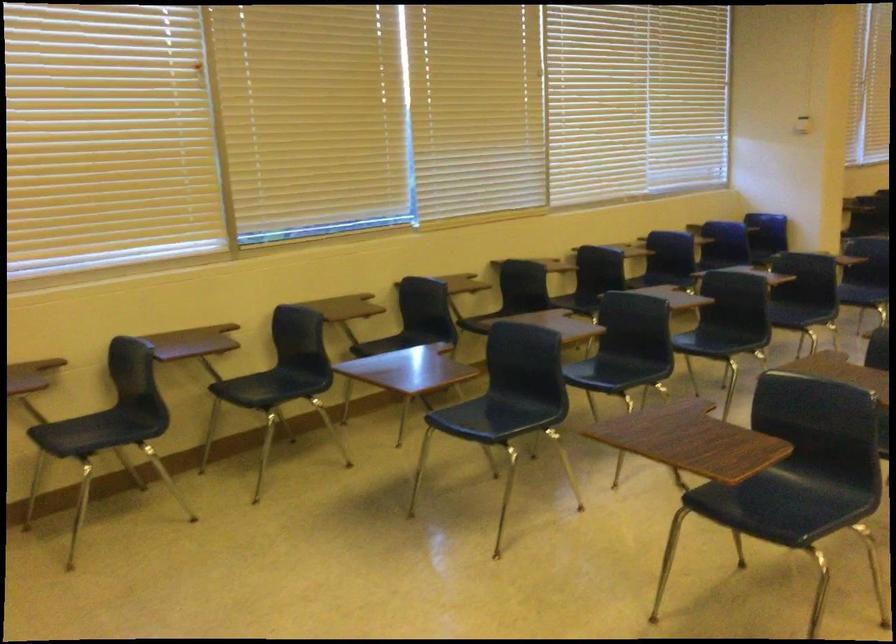
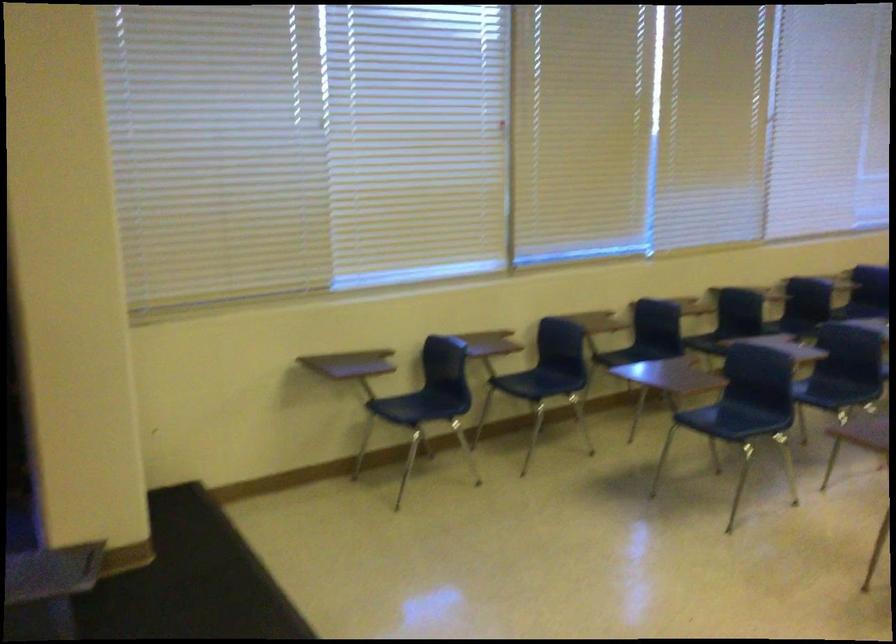
Where in the second image is the point corresponding to point (220, 93) from the first image?

(510, 152)